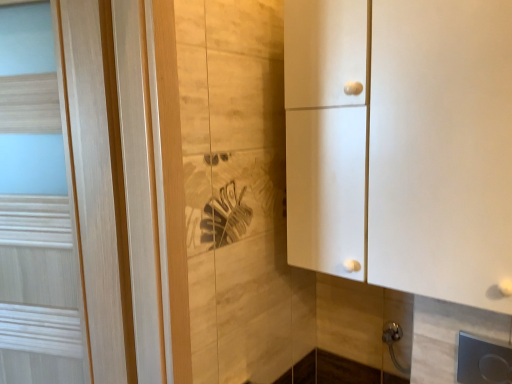
Where is `metallic silver door handle at lower right`? metallic silver door handle at lower right is located at coordinates (394, 342).

Locate an element on the screen. The width and height of the screenshot is (512, 384). white matte cabinet at right is located at coordinates (402, 144).

This screenshot has height=384, width=512. I want to click on metallic silver door handle at lower right, so click(394, 342).

Consider the image. Is there a large distance between light wood door at left and white matte cabinet at right?

No, light wood door at left is not far from white matte cabinet at right.

Does light wood door at left lie behind white matte cabinet at right?

Yes, it is behind white matte cabinet at right.

Is point (28, 200) in front of point (507, 212)?

No, (28, 200) is further to viewer.

Which is less distant, (392, 353) or (486, 264)?

The point (486, 264) is more forward.

Is metallic silver door handle at lower right looking in the opposite direction of white matte cabinet at right?

No, metallic silver door handle at lower right is not facing the opposite direction of white matte cabinet at right.

Would you say white matte cabinet at right is part of metallic silver door handle at lower right's contents?

No, white matte cabinet at right is not inside metallic silver door handle at lower right.

Is metallic silver door handle at lower right next to white matte cabinet at right and touching it?

metallic silver door handle at lower right and white matte cabinet at right are clearly separated.

Does white matte cabinet at right appear on the right side of light wood door at left?

Indeed, white matte cabinet at right is positioned on the right side of light wood door at left.

Considering the points (310, 263) and (46, 359), which point is in front, point (310, 263) or point (46, 359)?

The point (46, 359) is closer.

From the image's perspective, between white matte cabinet at right and light wood door at left, who is located below?

light wood door at left, from the image's perspective.

Locate an element on the screen. The image size is (512, 384). door that appears on the left of white matte cabinet at right is located at coordinates (38, 254).

Based on the photo, which is less distant, (303, 153) or (404, 371)?

The point (303, 153) is closer.

Would you say white matte cabinet at right contains metallic silver door handle at lower right?

Actually, metallic silver door handle at lower right is outside white matte cabinet at right.

Is light wood door at left to the right of metallic silver door handle at lower right from the viewer's perspective?

Incorrect, light wood door at left is not on the right side of metallic silver door handle at lower right.

Is light wood door at left positioned beyond the bounds of metallic silver door handle at lower right?

Yes, light wood door at left is located beyond the bounds of metallic silver door handle at lower right.

Are light wood door at left and metallic silver door handle at lower right beside each other?

light wood door at left and metallic silver door handle at lower right are not in contact.

From a real-world perspective, is light wood door at left positioned above or below metallic silver door handle at lower right?

From a real-world perspective, light wood door at left is physically above metallic silver door handle at lower right.

Is point (386, 336) closer to camera compared to point (55, 227)?

No, (386, 336) is further to viewer.

Considering the sizes of metallic silver door handle at lower right and light wood door at left in the image, is metallic silver door handle at lower right wider or thinner than light wood door at left?

Clearly, metallic silver door handle at lower right has less width compared to light wood door at left.

From the image's perspective, is metallic silver door handle at lower right located above or below light wood door at left?

Clearly, from the image's perspective, metallic silver door handle at lower right is below light wood door at left.

Which of these two, metallic silver door handle at lower right or light wood door at left, is bigger?

light wood door at left.

You are a GUI agent. You are given a task and a screenshot of the screen. Output one action in this format:
    pyautogui.click(x=<x>, y=<y>)
    Task: Click on the door located below the white matte cabinet at right (from the image's perspective)
    This screenshot has width=512, height=384.
    Given the screenshot: What is the action you would take?
    pyautogui.click(x=38, y=254)

The width and height of the screenshot is (512, 384). What are the coordinates of `cupboard that is above the metallic silver door handle at lower right (from a real-world perspective)` in the screenshot? It's located at (402, 144).

Based on their spatial positions, is metallic silver door handle at lower right or light wood door at left closer to white matte cabinet at right?

The object closer to white matte cabinet at right is metallic silver door handle at lower right.

Based on their spatial positions, is metallic silver door handle at lower right or white matte cabinet at right closer to light wood door at left?

white matte cabinet at right is closer to light wood door at left.

Estimate the real-world distances between objects in this image. Which object is closer to metallic silver door handle at lower right, light wood door at left or white matte cabinet at right?

white matte cabinet at right.

Looking at the image, which one is located closer to metallic silver door handle at lower right, white matte cabinet at right or light wood door at left?

The object closer to metallic silver door handle at lower right is white matte cabinet at right.

Based on their spatial positions, is light wood door at left or metallic silver door handle at lower right further from white matte cabinet at right?

Based on the image, light wood door at left appears to be further to white matte cabinet at right.

Looking at the image, which one is located closer to light wood door at left, white matte cabinet at right or metallic silver door handle at lower right?

white matte cabinet at right is positioned closer to the anchor light wood door at left.

This screenshot has width=512, height=384. Identify the location of cupboard between light wood door at left and metallic silver door handle at lower right. pos(402,144).